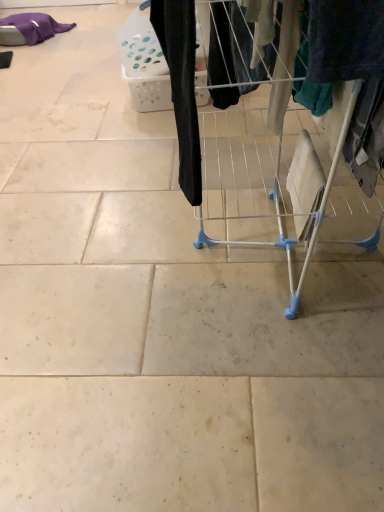
What do you see at coordinates (342, 117) in the screenshot? The image size is (384, 512). I see `white wire drying rack at center` at bounding box center [342, 117].

Locate an element on the screen. purple cotton blanket at upper left, which is counted as the 2th clothing, starting from the front is located at coordinates (29, 29).

Measure the distance between point (182, 176) and camera.

Point (182, 176) and camera are 1.12 meters apart.

Locate an element on the screen. This screenshot has width=384, height=512. white wire drying rack at center is located at coordinates (342, 117).

Is black fabric pants at center, which is counted as the 2th clothing, starting from the top, beside white wire drying rack at center?

No.

The height and width of the screenshot is (512, 384). I want to click on the 1st clothing to the left of the white wire drying rack at center, starting your count from the anchor, so click(x=182, y=85).

Which is more to the left, black fabric pants at center, acting as the 2th clothing starting from the back, or white wire drying rack at center?

Positioned to the left is black fabric pants at center, acting as the 2th clothing starting from the back.

Between black fabric pants at center, which is the first clothing in front-to-back order, and white wire drying rack at center, which one has smaller size?

Smaller between the two is black fabric pants at center, which is the first clothing in front-to-back order.

Considering the sizes of purple cotton blanket at upper left, which is counted as the 1th clothing, starting from the top, and black fabric pants at center, which appears as the 2th clothing when viewed from the left, in the image, is purple cotton blanket at upper left, which is counted as the 1th clothing, starting from the top, taller or shorter than black fabric pants at center, which appears as the 2th clothing when viewed from the left,?

Considering their sizes, purple cotton blanket at upper left, which is counted as the 1th clothing, starting from the top, has less height than black fabric pants at center, which appears as the 2th clothing when viewed from the left.

Does purple cotton blanket at upper left, the 2th clothing from the bottom, touch black fabric pants at center, positioned as the first clothing in right-to-left order?

No, purple cotton blanket at upper left, the 2th clothing from the bottom, is not touching black fabric pants at center, positioned as the first clothing in right-to-left order.

Is purple cotton blanket at upper left, which is counted as the 2th clothing, starting from the front, looking in the opposite direction of black fabric pants at center, the first clothing when ordered from bottom to top?

No, purple cotton blanket at upper left, which is counted as the 2th clothing, starting from the front, is not facing the opposite direction of black fabric pants at center, the first clothing when ordered from bottom to top.

Considering their positions, is white wire drying rack at center located in front of or behind purple cotton blanket at upper left, the 2th clothing from the bottom?

In the image, white wire drying rack at center appears in front of purple cotton blanket at upper left, the 2th clothing from the bottom.

From the image's perspective, relative to purple cotton blanket at upper left, which is counted as the 1th clothing, starting from the top, is white wire drying rack at center above or below?

white wire drying rack at center is situated lower than purple cotton blanket at upper left, which is counted as the 1th clothing, starting from the top, in the image.

Would you say white wire drying rack at center is outside purple cotton blanket at upper left, placed as the first clothing when sorted from left to right?

That's correct, white wire drying rack at center is outside of purple cotton blanket at upper left, placed as the first clothing when sorted from left to right.

Are white wire drying rack at center and purple cotton blanket at upper left, which is the first clothing from back to front, beside each other?

They are not placed beside each other.

Is the surface of white wire drying rack at center in direct contact with black fabric pants at center, which is counted as the 2th clothing, starting from the top?

white wire drying rack at center is not next to black fabric pants at center, which is counted as the 2th clothing, starting from the top, and they're not touching.

From a real-world perspective, who is located lower, white wire drying rack at center or black fabric pants at center, acting as the 2th clothing starting from the back?

From a 3D spatial view, white wire drying rack at center is below.

In the scene shown: Is white wire drying rack at center facing away from black fabric pants at center, the first clothing when ordered from bottom to top?

No, black fabric pants at center, the first clothing when ordered from bottom to top, is not at the back of white wire drying rack at center.

From the image's perspective, would you say black fabric pants at center, acting as the 2th clothing starting from the back, is positioned over purple cotton blanket at upper left, the 2th clothing from the bottom?

No, from the image's perspective, black fabric pants at center, acting as the 2th clothing starting from the back, is not over purple cotton blanket at upper left, the 2th clothing from the bottom.

Does black fabric pants at center, positioned as the first clothing in right-to-left order, come behind purple cotton blanket at upper left, which is counted as the 1th clothing, starting from the top?

No, it is not.

Which of these two, black fabric pants at center, positioned as the first clothing in right-to-left order, or purple cotton blanket at upper left, which is counted as the 1th clothing, starting from the top, is thinner?

black fabric pants at center, positioned as the first clothing in right-to-left order, is thinner.

Does black fabric pants at center, which is counted as the 2th clothing, starting from the top, have a smaller size compared to purple cotton blanket at upper left, placed as the second clothing when sorted from right to left?

Yes.

Considering the sizes of objects purple cotton blanket at upper left, placed as the first clothing when sorted from left to right, and white wire drying rack at center in the image provided, who is smaller, purple cotton blanket at upper left, placed as the first clothing when sorted from left to right, or white wire drying rack at center?

Smaller between the two is purple cotton blanket at upper left, placed as the first clothing when sorted from left to right.

Could you measure the distance between purple cotton blanket at upper left, placed as the first clothing when sorted from left to right, and white wire drying rack at center?

purple cotton blanket at upper left, placed as the first clothing when sorted from left to right, and white wire drying rack at center are 3.12 meters apart from each other.

Which clothing is the 2nd one when counting from the left side of the white wire drying rack at center? Please provide its 2D coordinates.

[(29, 29)]

Is purple cotton blanket at upper left, the 2th clothing from the bottom, looking in the opposite direction of white wire drying rack at center?

No, white wire drying rack at center is not at the back of purple cotton blanket at upper left, the 2th clothing from the bottom.

The height and width of the screenshot is (512, 384). Find the location of `clothing above the white wire drying rack at center (from a real-world perspective)`. clothing above the white wire drying rack at center (from a real-world perspective) is located at coordinates (182, 85).

I want to click on clothing on the left of black fabric pants at center, which is the first clothing in front-to-back order, so click(29, 29).

When comparing their distances from purple cotton blanket at upper left, placed as the first clothing when sorted from left to right, does black fabric pants at center, which appears as the 2th clothing when viewed from the left, or white wire drying rack at center seem further?

black fabric pants at center, which appears as the 2th clothing when viewed from the left.

Looking at the image, which one is located further to white wire drying rack at center, purple cotton blanket at upper left, which is counted as the 2th clothing, starting from the front, or black fabric pants at center, which is counted as the 2th clothing, starting from the top?

The object further to white wire drying rack at center is purple cotton blanket at upper left, which is counted as the 2th clothing, starting from the front.

Looking at the image, which one is located further to black fabric pants at center, which is the first clothing in front-to-back order, white wire drying rack at center or purple cotton blanket at upper left, the 2th clothing from the bottom?

purple cotton blanket at upper left, the 2th clothing from the bottom.

When comparing their distances from black fabric pants at center, which appears as the 2th clothing when viewed from the left, does purple cotton blanket at upper left, placed as the second clothing when sorted from right to left, or white wire drying rack at center seem closer?

white wire drying rack at center.

From the image, which object appears to be nearer to purple cotton blanket at upper left, which is counted as the 2th clothing, starting from the front, white wire drying rack at center or black fabric pants at center, the first clothing when ordered from bottom to top?

The object closer to purple cotton blanket at upper left, which is counted as the 2th clothing, starting from the front, is white wire drying rack at center.

Looking at the image, which one is located further to white wire drying rack at center, black fabric pants at center, acting as the 2th clothing starting from the back, or purple cotton blanket at upper left, placed as the first clothing when sorted from left to right?

Based on the image, purple cotton blanket at upper left, placed as the first clothing when sorted from left to right, appears to be further to white wire drying rack at center.

This screenshot has width=384, height=512. Identify the location of clothing located between white wire drying rack at center and purple cotton blanket at upper left, which is counted as the 2th clothing, starting from the front, in the depth direction. (182, 85).